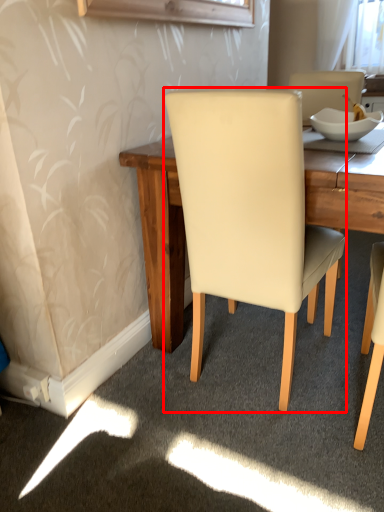
Question: From the image's perspective, considering the relative positions of chair (annotated by the red box) and bowl in the image provided, where is chair (annotated by the red box) located with respect to the staircase?

Choices:
 (A) above
 (B) below

Answer: (B)